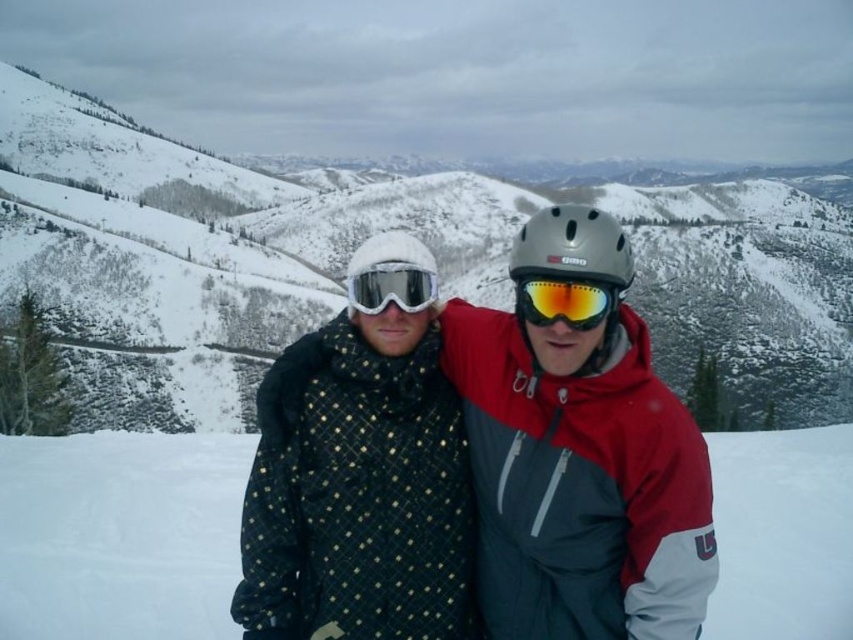
What do you see at coordinates (569, 284) in the screenshot? This screenshot has height=640, width=853. I see `matte gray helmet at center` at bounding box center [569, 284].

Is point (550, 365) more distant than point (386, 300)?

That is False.

This screenshot has height=640, width=853. I want to click on matte gray helmet at center, so click(569, 284).

Between shiny orange ski goggles at center and matte black goggles at center, which one is positioned lower?

shiny orange ski goggles at center is below.

This screenshot has width=853, height=640. What do you see at coordinates (563, 301) in the screenshot?
I see `shiny orange ski goggles at center` at bounding box center [563, 301].

Where is `shiny orange ski goggles at center`? The width and height of the screenshot is (853, 640). shiny orange ski goggles at center is located at coordinates [x=563, y=301].

Image resolution: width=853 pixels, height=640 pixels. Find the location of `shiny orange ski goggles at center`. shiny orange ski goggles at center is located at coordinates (x=563, y=301).

Who is positioned more to the left, snowy mountain at center or matte black goggles at center?

matte black goggles at center

Which is behind, point (291, 333) or point (392, 278)?

Positioned behind is point (291, 333).

Does point (700, 268) lie in front of point (381, 275)?

No, it is not.

The width and height of the screenshot is (853, 640). Find the location of `snowy mountain at center`. snowy mountain at center is located at coordinates (363, 237).